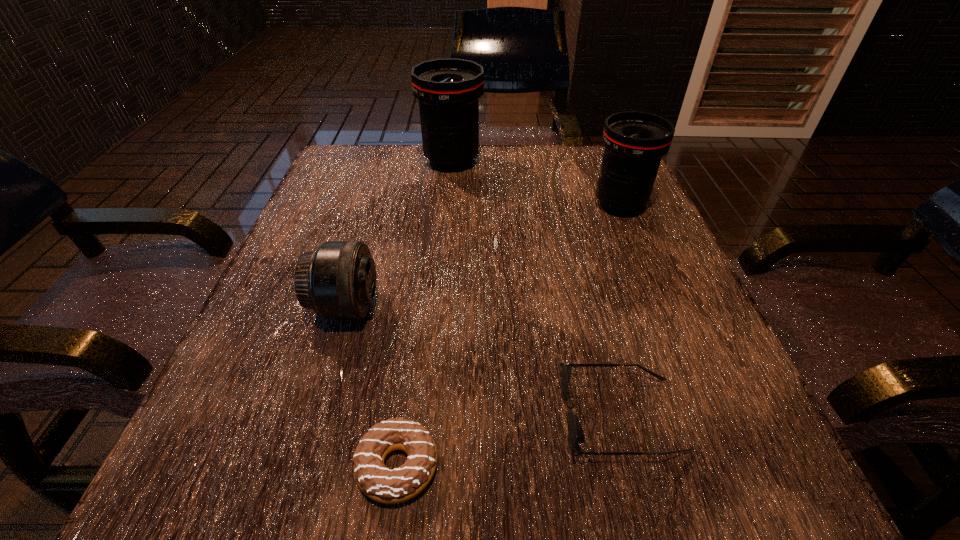
Locate an element on the screen. The height and width of the screenshot is (540, 960). vacant space positioned 0.180m on the front-facing side of the leftmost telephoto lens is located at coordinates (487, 307).

This screenshot has width=960, height=540. I want to click on vacant position located 0.160m on the front-facing side of the sunglasses, so [x=443, y=415].

Find the location of a particular element. vacant space located 0.080m on the front-facing side of the sunglasses is located at coordinates (503, 415).

The height and width of the screenshot is (540, 960). What are the coordinates of `vacant area situated on the front-facing side of the sunglasses` in the screenshot? It's located at (473, 415).

Identify the location of blank space located on the back of the shortest object. (412, 364).

The image size is (960, 540). What are the coordinates of `sunglasses positioned at the near edge` in the screenshot? It's located at (576, 435).

At what (x,y) coordinates should I click in order to perform the action: click on doughnut that is at the near edge. Please return your answer as a coordinate pair (x, y). Looking at the image, I should click on (389, 486).

Where is `object located at the left edge`? The width and height of the screenshot is (960, 540). object located at the left edge is located at coordinates (337, 280).

What are the coordinates of `telephoto lens at the right edge` in the screenshot? It's located at (634, 142).

The width and height of the screenshot is (960, 540). What are the coordinates of `sunglasses at the right edge` in the screenshot? It's located at (576, 435).